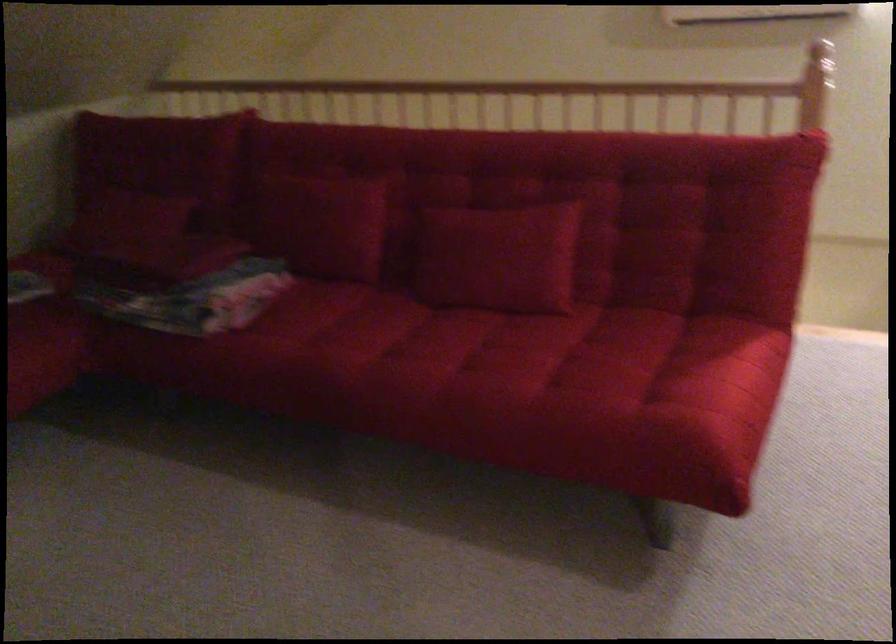
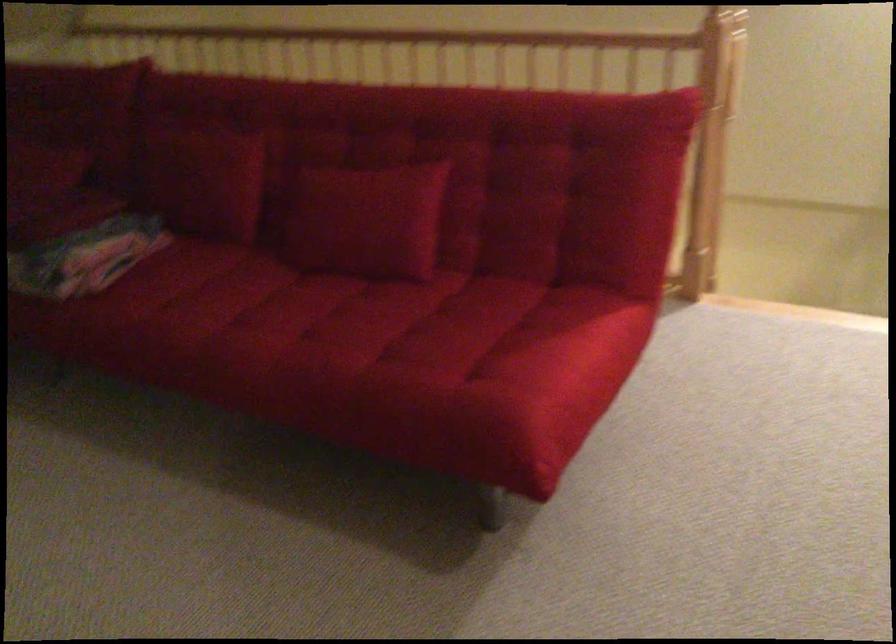
In the second image, find the point that corresponds to the point at 504,252 in the first image.

(366, 220)